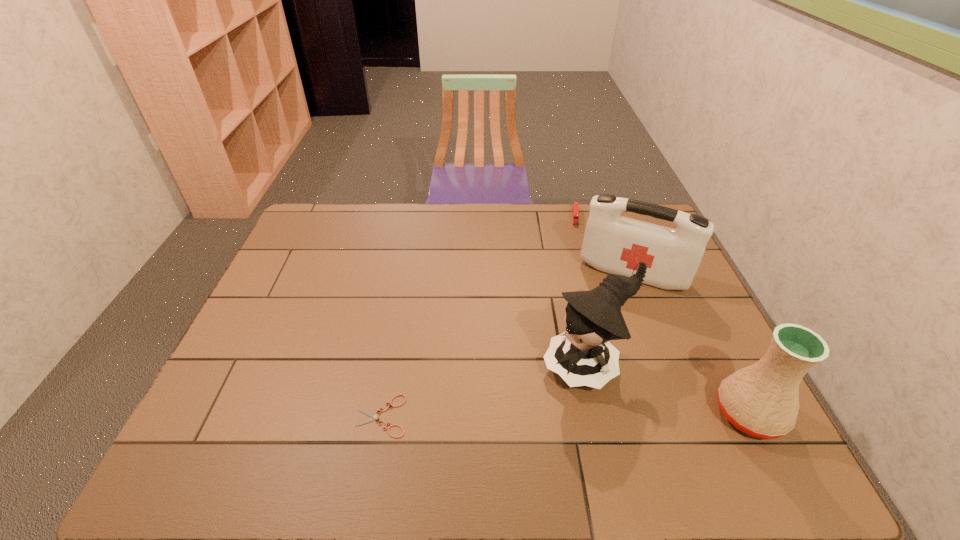
The height and width of the screenshot is (540, 960). Find the location of `the shortest object`. the shortest object is located at coordinates (373, 416).

Image resolution: width=960 pixels, height=540 pixels. In order to click on the leftmost object in this screenshot , I will do `click(373, 416)`.

The image size is (960, 540). I want to click on pottery, so click(x=761, y=400).

The height and width of the screenshot is (540, 960). Identify the location of the second shortest object. (575, 210).

Find the location of a particular element. stapler is located at coordinates (575, 210).

Locate an element on the screen. the second farthest object is located at coordinates (612, 243).

The width and height of the screenshot is (960, 540). Find the location of `doll`. doll is located at coordinates (582, 356).

Locate an element on the screen. This screenshot has height=540, width=960. vacant position located 0.310m on the right of the shears is located at coordinates (541, 416).

You are a GUI agent. You are given a task and a screenshot of the screen. Output one action in this format:
    pyautogui.click(x=<x>, y=<y>)
    Task: Click on the free region located on the back of the pottery
    
    Given the screenshot: What is the action you would take?
    pyautogui.click(x=708, y=332)

At what (x,y) coordinates should I click in order to perform the action: click on free region located on the front-facing side of the stapler. Please return your answer as a coordinate pair (x, y). The width and height of the screenshot is (960, 540). Looking at the image, I should click on (577, 277).